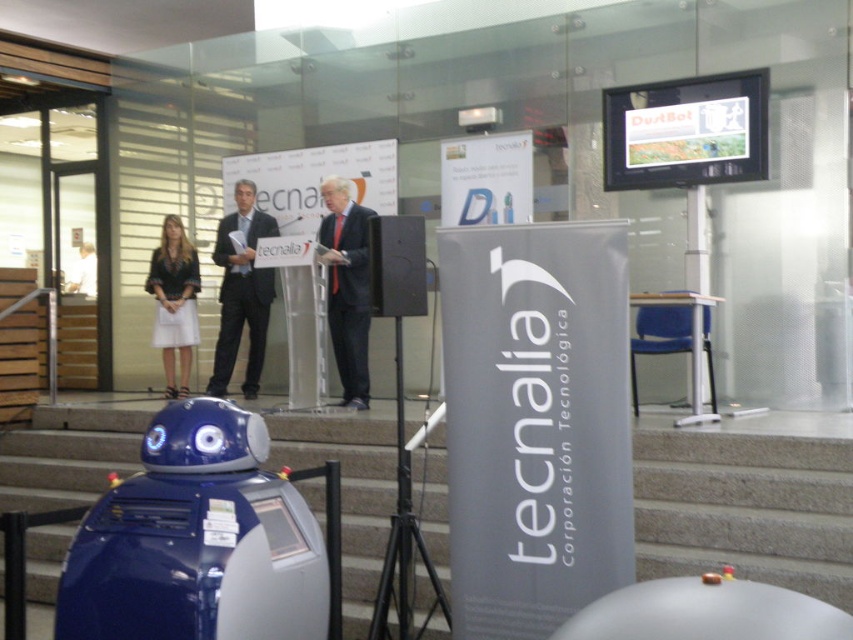
Question: Estimate the real-world distances between objects in this image. Which object is closer to the dark blue suit at center?

Choices:
 (A) concrete stairs at lower center
 (B) matte black dress at center
 (C) dark gray suit at center

Answer: (B)

Question: Is dark blue suit at center below matte black dress at center?

Choices:
 (A) no
 (B) yes

Answer: (A)

Question: Is dark blue suit at center to the right of matte black dress at center from the viewer's perspective?

Choices:
 (A) no
 (B) yes

Answer: (B)

Question: Does dark gray suit at center have a larger size compared to matte black dress at center?

Choices:
 (A) yes
 (B) no

Answer: (B)

Question: Among these objects, which one is farthest from the camera?

Choices:
 (A) dark gray suit at center
 (B) matte black dress at center
 (C) dark blue suit at center
 (D) concrete stairs at lower center

Answer: (B)

Question: Which object appears closest to the camera in this image?

Choices:
 (A) dark gray suit at center
 (B) matte black dress at center
 (C) concrete stairs at lower center

Answer: (C)